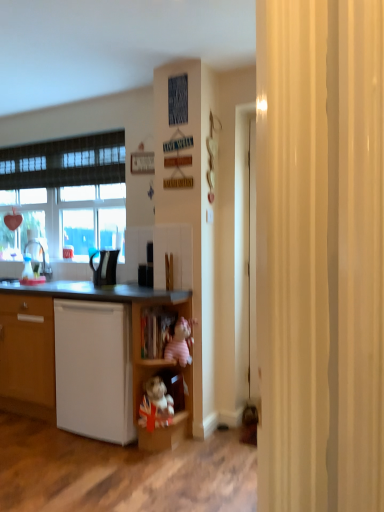
Question: Is wooden plush toy at lower center, the 2th cabinet positioned from the top, to the left of black glossy kettle at center, which appears as the second appliance when viewed from the right, from the viewer's perspective?

Choices:
 (A) yes
 (B) no

Answer: (B)

Question: From a real-world perspective, is wooden plush toy at lower center, which ranks as the 1th cabinet in bottom-to-top order, below black glossy kettle at center, which appears as the second appliance when viewed from the right?

Choices:
 (A) no
 (B) yes

Answer: (B)

Question: Is black glossy kettle at center, the first appliance viewed from the left, located within wooden plush toy at lower center, which ranks as the 1th cabinet in bottom-to-top order?

Choices:
 (A) yes
 (B) no

Answer: (B)

Question: Is wooden plush toy at lower center, the 2th cabinet positioned from the top, completely or partially outside of black glossy kettle at center, which appears as the second appliance when viewed from the right?

Choices:
 (A) no
 (B) yes

Answer: (B)

Question: Is wooden plush toy at lower center, which ranks as the 1th cabinet in bottom-to-top order, smaller than black glossy kettle at center, which appears as the second appliance when viewed from the right?

Choices:
 (A) yes
 (B) no

Answer: (B)

Question: Considering the positions of point click(x=117, y=359) and point click(x=97, y=353), is point click(x=117, y=359) closer or farther from the camera than point click(x=97, y=353)?

Choices:
 (A) closer
 (B) farther

Answer: (A)

Question: From the image's perspective, is white matte dishwasher at lower left above or below white matte cupboard at lower left?

Choices:
 (A) below
 (B) above

Answer: (A)

Question: In the image, is white matte dishwasher at lower left positioned in front of or behind white matte cupboard at lower left?

Choices:
 (A) front
 (B) behind

Answer: (B)

Question: From a real-world perspective, is white matte dishwasher at lower left positioned above or below white matte cupboard at lower left?

Choices:
 (A) above
 (B) below

Answer: (B)

Question: From a real-world perspective, is white matte cupboard at lower left above or below white matte dishwasher at lower left?

Choices:
 (A) above
 (B) below

Answer: (A)

Question: Is white matte cupboard at lower left inside the boundaries of white matte dishwasher at lower left, or outside?

Choices:
 (A) inside
 (B) outside

Answer: (A)

Question: Considering the positions of white matte cupboard at lower left and white matte dishwasher at lower left in the image, is white matte cupboard at lower left bigger or smaller than white matte dishwasher at lower left?

Choices:
 (A) small
 (B) big

Answer: (B)

Question: Is white matte cupboard at lower left in front of or behind white matte dishwasher at lower left in the image?

Choices:
 (A) behind
 (B) front

Answer: (B)

Question: In terms of height, does black plastic kettle at center, the 2th appliance in the left-to-right sequence, look taller or shorter compared to wooden shelf at center?

Choices:
 (A) tall
 (B) short

Answer: (B)

Question: Visually, is black plastic kettle at center, the 2th appliance in the left-to-right sequence, positioned to the left or to the right of wooden shelf at center?

Choices:
 (A) left
 (B) right

Answer: (A)